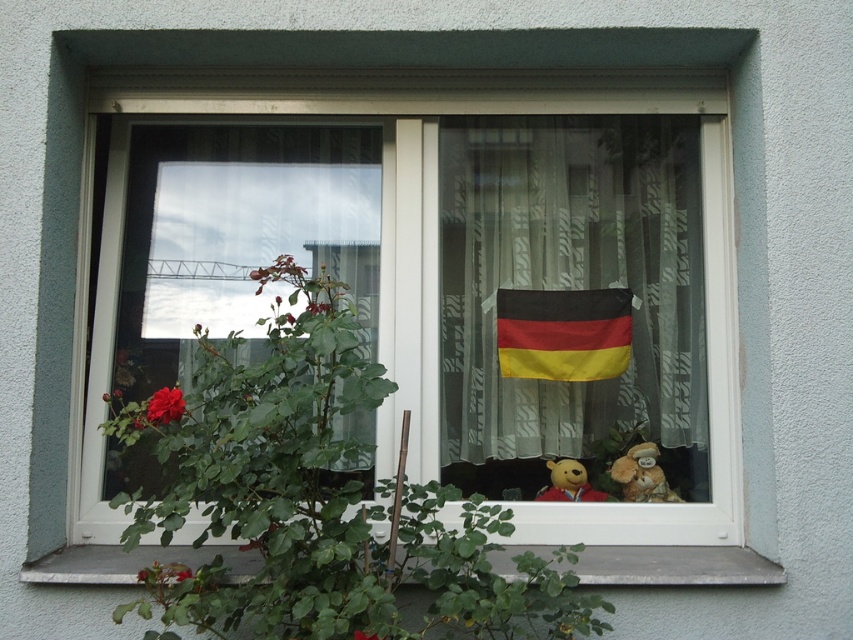
Which is behind, point (669, 388) or point (155, 412)?

The point (669, 388) is more distant.

Is point (254, 161) farther from camera compared to point (177, 416)?

Yes, point (254, 161) is behind point (177, 416).

You are a GUI agent. You are given a task and a screenshot of the screen. Output one action in this format:
    pyautogui.click(x=<x>, y=<y>)
    Task: Click on the matte plastic window at center
    Image resolution: width=853 pixels, height=640 pixels.
    Given the screenshot: What is the action you would take?
    pyautogui.click(x=440, y=262)

Identify the location of silky sheer curtain at center. The height and width of the screenshot is (640, 853). (570, 276).

Who is positioned more to the right, silky sheer curtain at center or gray concrete at lower center?

gray concrete at lower center

Is point (625, 252) farther from viewer compared to point (660, 570)?

Yes, point (625, 252) is behind point (660, 570).

Where is `silky sheer curtain at center`? silky sheer curtain at center is located at coordinates (570, 276).

Between silky sheer curtain at center and matte red rose at lower left, which one is positioned lower?

Positioned lower is matte red rose at lower left.

Does silky sheer curtain at center come behind matte red rose at lower left?

Yes, silky sheer curtain at center is behind matte red rose at lower left.

Does point (662, 264) lie in front of point (157, 396)?

That is False.

Image resolution: width=853 pixels, height=640 pixels. I want to click on silky sheer curtain at center, so click(x=570, y=276).